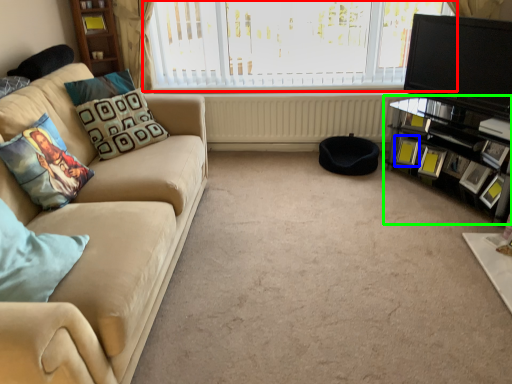
Question: Which object is the closest to the window (highlighted by a red box)? Choose among these: picture frame (highlighted by a blue box) or entertainment center (highlighted by a green box).

Choices:
 (A) picture frame
 (B) entertainment center

Answer: (B)